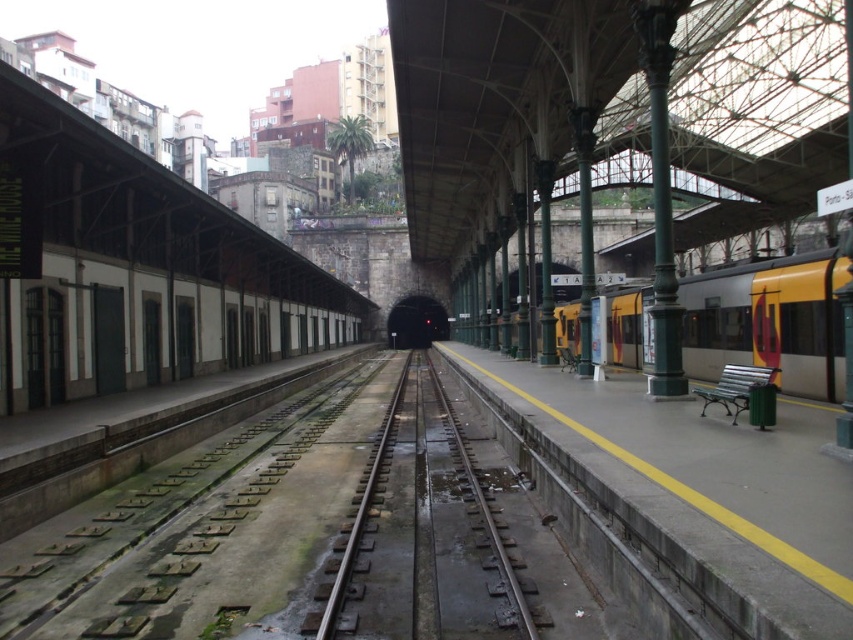
Is point (728, 557) positioned after point (782, 317)?

No, it is not.

Does concrete platform at center have a lesser height compared to yellow metallic train at right?

Indeed, concrete platform at center has a lesser height compared to yellow metallic train at right.

What do you see at coordinates (685, 490) in the screenshot? The image size is (853, 640). I see `concrete platform at center` at bounding box center [685, 490].

Locate an element on the screen. concrete platform at center is located at coordinates (685, 490).

Which is below, yellow metallic train at right or smooth concrete train track at center?

smooth concrete train track at center is below.

Is yellow metallic train at right shorter than smooth concrete train track at center?

Incorrect, yellow metallic train at right's height does not fall short of smooth concrete train track at center's.

Between point (680, 280) and point (397, 403), which one is positioned in front?

Point (680, 280) is more forward.

Locate an element on the screen. The image size is (853, 640). yellow metallic train at right is located at coordinates (769, 321).

Does concrete platform at center appear on the left side of smooth concrete train track at center?

No, concrete platform at center is not to the left of smooth concrete train track at center.

Describe the element at coordinates (685, 490) in the screenshot. I see `concrete platform at center` at that location.

The width and height of the screenshot is (853, 640). In order to click on concrete platform at center in this screenshot , I will do `click(685, 490)`.